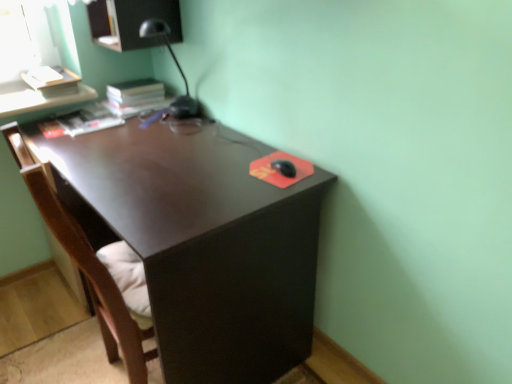
Question: Is brown wood swivel chair at left positioned behind matte black desk at center?

Choices:
 (A) yes
 (B) no

Answer: (B)

Question: Would you say brown wood swivel chair at left is outside matte black desk at center?

Choices:
 (A) no
 (B) yes

Answer: (A)

Question: From the image's perspective, is brown wood swivel chair at left located above matte black desk at center?

Choices:
 (A) yes
 (B) no

Answer: (B)

Question: Could you tell me if brown wood swivel chair at left is facing matte black desk at center?

Choices:
 (A) no
 (B) yes

Answer: (B)

Question: Is brown wood swivel chair at left to the left of matte black desk at center from the viewer's perspective?

Choices:
 (A) no
 (B) yes

Answer: (B)

Question: Is brown wood swivel chair at left far away from matte black desk at center?

Choices:
 (A) yes
 (B) no

Answer: (B)

Question: Would you say brown wood swivel chair at left is part of matte black desk at center's contents?

Choices:
 (A) yes
 (B) no

Answer: (A)

Question: From the image's perspective, is matte black desk at center located beneath brown wood swivel chair at left?

Choices:
 (A) no
 (B) yes

Answer: (A)

Question: Is the position of matte black desk at center more distant than that of brown wood swivel chair at left?

Choices:
 (A) yes
 (B) no

Answer: (A)

Question: From a real-world perspective, is matte black desk at center positioned under brown wood swivel chair at left based on gravity?

Choices:
 (A) no
 (B) yes

Answer: (B)

Question: Does matte black desk at center have a larger size compared to brown wood swivel chair at left?

Choices:
 (A) yes
 (B) no

Answer: (A)

Question: Is matte black desk at center outside brown wood swivel chair at left?

Choices:
 (A) no
 (B) yes

Answer: (B)

Question: From a real-world perspective, relative to brown wood swivel chair at left, is matte black desk at center vertically above or below?

Choices:
 (A) below
 (B) above

Answer: (A)